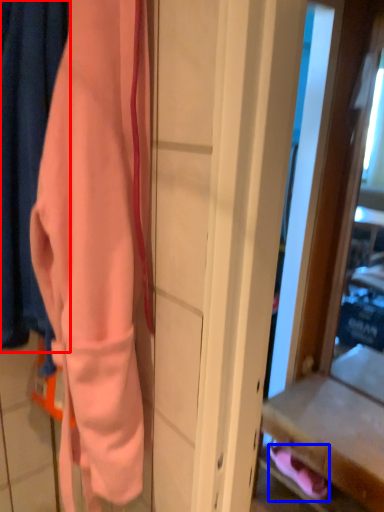
Question: Which point is closer to the camera, curtain (highlighted by a red box) or footwear (highlighted by a blue box)?

Choices:
 (A) curtain
 (B) footwear

Answer: (A)